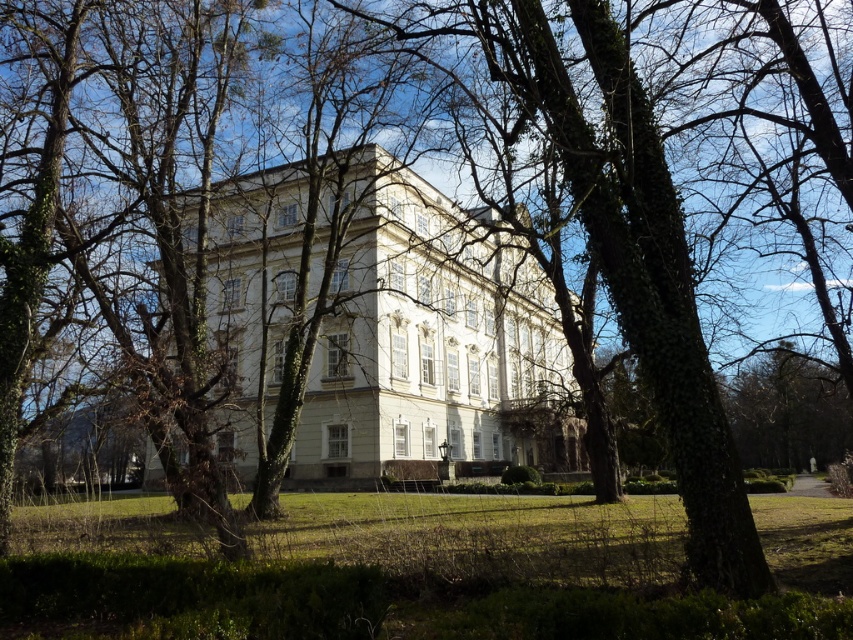
Question: Considering the relative positions of green grass at lower center and white glossy mansion at center in the image provided, where is green grass at lower center located with respect to white glossy mansion at center?

Choices:
 (A) above
 (B) below

Answer: (A)

Question: Does green grass at lower center have a greater width compared to white glossy mansion at center?

Choices:
 (A) no
 (B) yes

Answer: (A)

Question: Which of the following is the farthest from the observer?

Choices:
 (A) green grass at lower center
 (B) white glossy mansion at center

Answer: (B)

Question: Does green grass at lower center have a larger size compared to white glossy mansion at center?

Choices:
 (A) yes
 (B) no

Answer: (B)